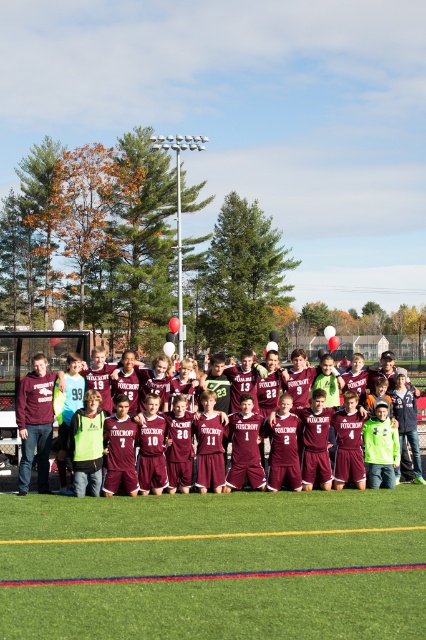
You are a photographer setting up for a soccer team photo. You notice the green artificial turf at center and the maroon jersey at center in the scene. Which object should you adjust your camera focus to first if you want to capture both clearly in the same frame?

The green artificial turf at center is smaller than the maroon jersey at center, so you should focus on the maroon jersey at center first as it is larger and more prominent in the frame.

You are a soccer coach trying to set up a small practice area for drills. You have a 2 meter wide equipment bag that needs to be placed between the green artificial turf at center and the maroon jersey at center. Can the equipment bag fit between them?

The green artificial turf at center is narrower than the maroon jersey at center. Since the equipment bag is 2 meters wide, it can only fit if the space between them is at least 2 meters. However, the description states the green artificial turf at center has a smaller width than the maroon jersey at center, but doesn

You are a photographer taking a picture of the soccer team. You notice the green artificial turf at center and the maroon jersey at center. Which object is located to the right of the other?

The green artificial turf at center is positioned on the right side of maroon jersey at center.